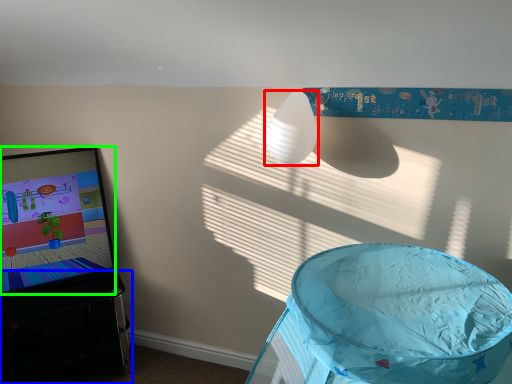
Question: Which is nearer to the lamp (highlighted by a red box)? furniture (highlighted by a blue box) or computer screen (highlighted by a green box).

Choices:
 (A) furniture
 (B) computer screen

Answer: (B)